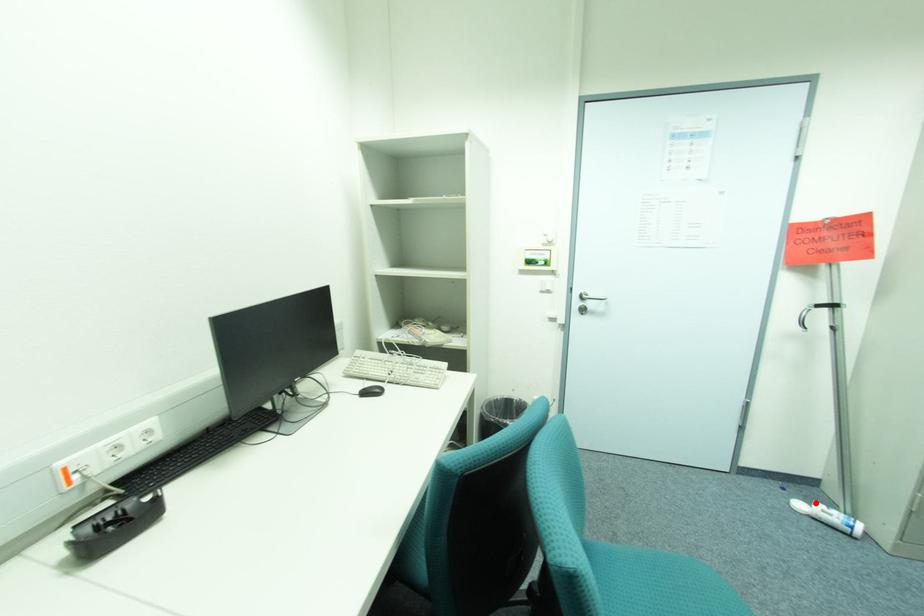
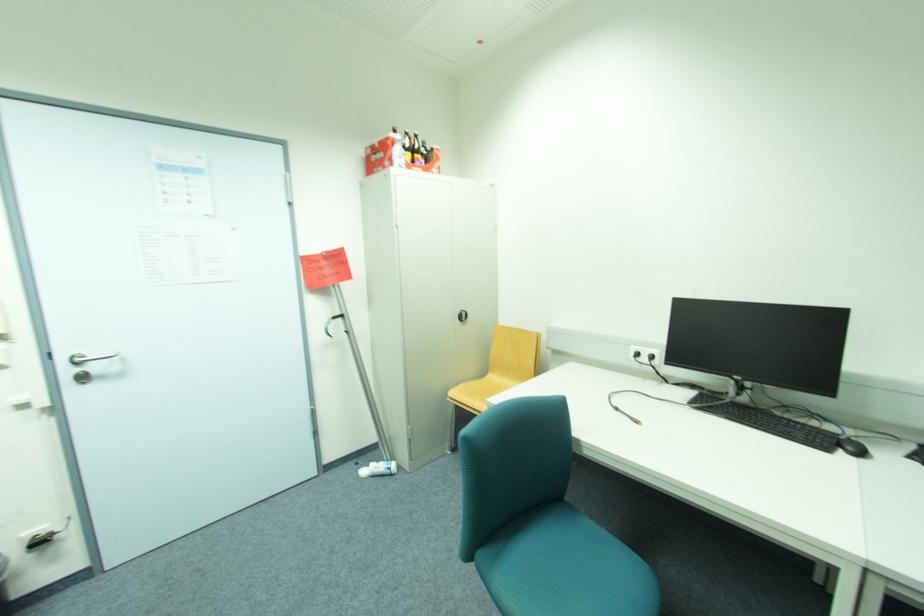
In the second image, find the point that corresponds to the highlighted location in the first image.

(373, 468)